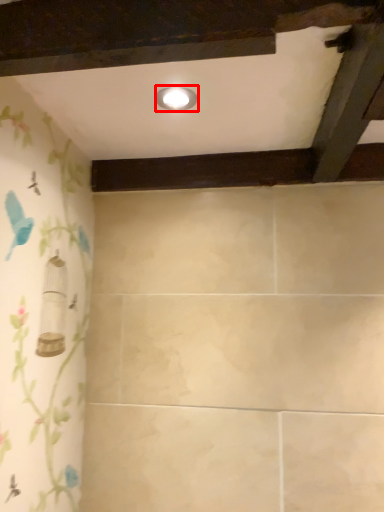
Question: From the image's perspective, what is the correct spatial relationship of light fixture (annotated by the red box) in relation to plank?

Choices:
 (A) above
 (B) below

Answer: (A)